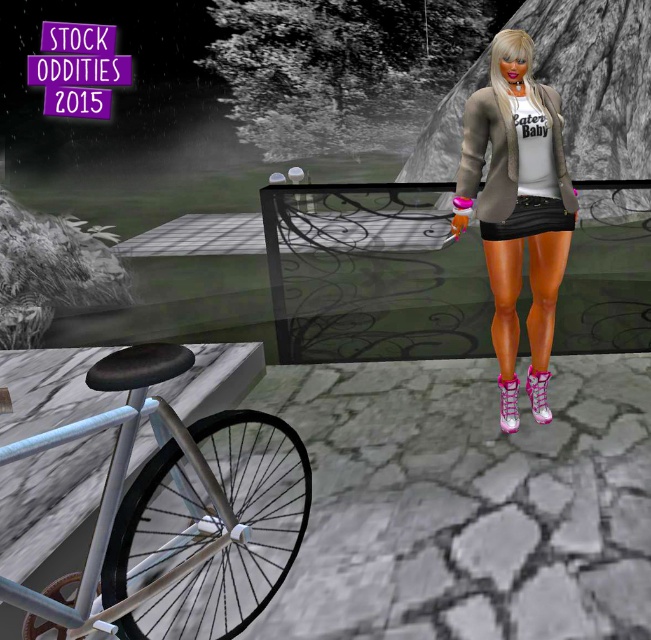
Question: Does shiny metallic jacket at upper right have a smaller size compared to black matte skirt at center?

Choices:
 (A) no
 (B) yes

Answer: (A)

Question: Which of the following is the farthest from the observer?

Choices:
 (A) (477, 205)
 (B) (542, 419)
 (C) (503, 410)

Answer: (C)

Question: Does shiny metallic jacket at upper right have a greater width compared to pink suede boot at lower center?

Choices:
 (A) yes
 (B) no

Answer: (A)

Question: Which point is closer to the camera taking this photo?

Choices:
 (A) (542, 280)
 (B) (544, 204)
 (C) (270, 458)

Answer: (B)

Question: Which point is farther to the camera?

Choices:
 (A) shiny metallic jacket at upper right
 (B) pink suede boot at lower center
 (C) black matte skirt at center
 (D) silver metallic bicycle at lower left

Answer: (B)

Question: Can you confirm if black matte skirt at center is smaller than pink suede boot at lower center?

Choices:
 (A) no
 (B) yes

Answer: (A)